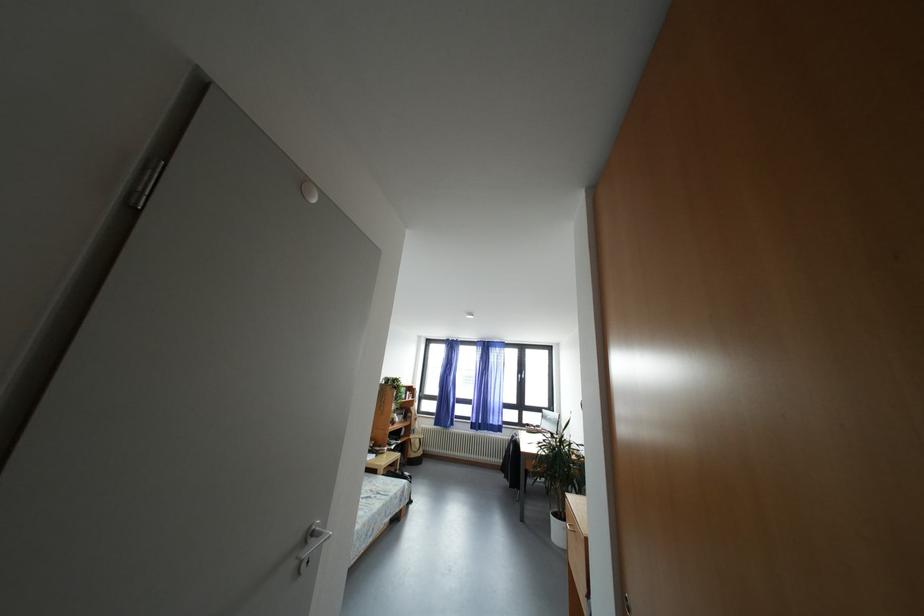
Where is `sofa sitting surface`? sofa sitting surface is located at coordinates (x=372, y=493).